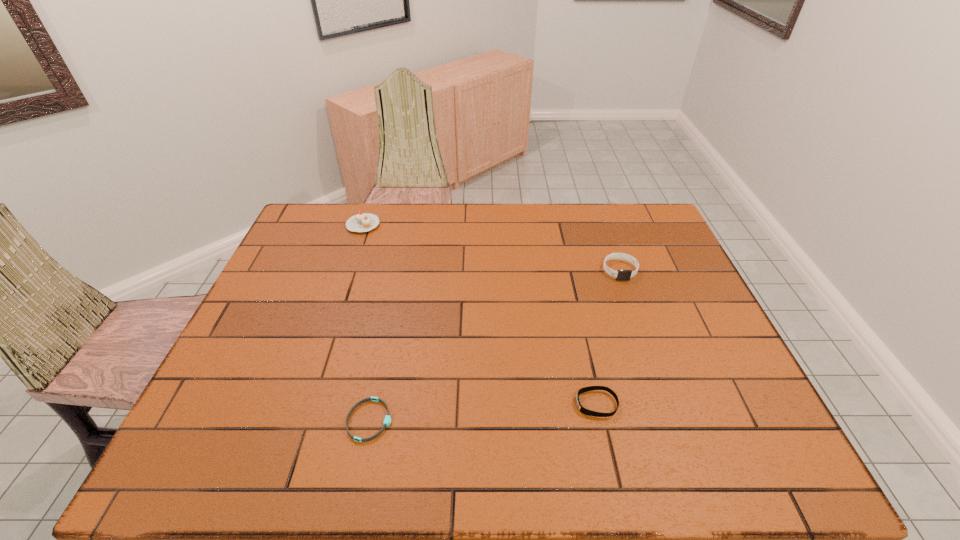
The height and width of the screenshot is (540, 960). What are the coordinates of `free space located on the display of the second wristband from right to left` in the screenshot? It's located at (400, 404).

I want to click on vacant region located 0.180m on the display of the second wristband from right to left, so click(496, 404).

Find the location of a particular element. The image size is (960, 540). vacant space located on the display of the second wristband from right to left is located at coordinates (527, 404).

Identify the location of vacant space located on the buckle of the shortest wristband. The height and width of the screenshot is (540, 960). (527, 420).

At what (x,y) coordinates should I click in order to perform the action: click on object located in the far edge section of the desktop. Please return your answer as a coordinate pair (x, y). The image size is (960, 540). Looking at the image, I should click on (362, 222).

Image resolution: width=960 pixels, height=540 pixels. I want to click on object that is at the near edge, so click(x=387, y=420).

Where is `object that is positioned at the right edge`? This screenshot has width=960, height=540. object that is positioned at the right edge is located at coordinates (622, 275).

Find the location of a particular element. free space at the far edge of the desktop is located at coordinates (359, 234).

This screenshot has width=960, height=540. What are the coordinates of `vacant region at the near edge` in the screenshot? It's located at (432, 448).

This screenshot has height=540, width=960. I want to click on free space at the left edge of the desktop, so point(285,327).